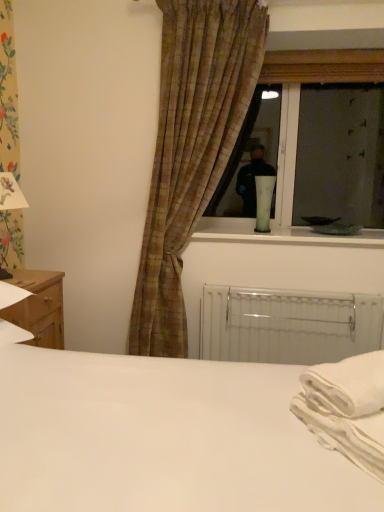
Where is `free space that is to the left of green glass vase at window, which is the 2th table lamp in front-to-back order`? The image size is (384, 512). free space that is to the left of green glass vase at window, which is the 2th table lamp in front-to-back order is located at coordinates (231, 234).